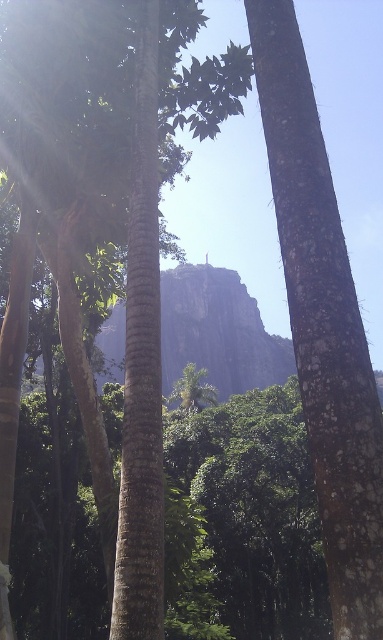
You are standing in the forest and see two points marked in the image. The first point is at coordinates point (235, 278) and the second point is at point (173, 392). Which point is closer to you?

Point (235, 278) is further to the viewer than point (173, 392), so the second point is closer to you.

You are an explorer trying to determine the distance between two central objects in the scene. Which one is nearer to you, the rugged stone mountain at center or the green leafy palm tree at center?

The rugged stone mountain at center is closer to the viewer than the green leafy palm tree at center according to the description.